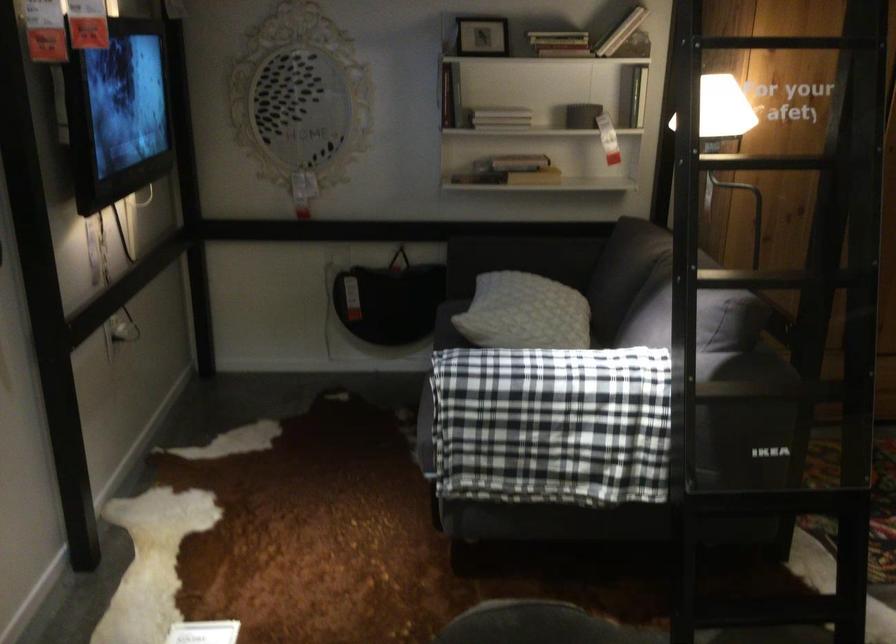
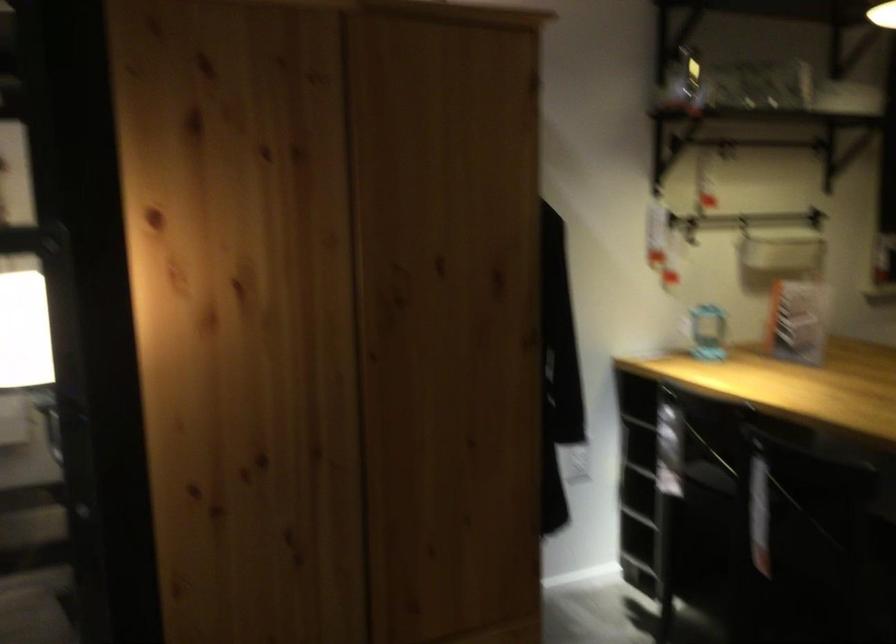
In a continuous first-person perspective shot, in which direction is the camera moving?

The cameraman moved toward right, forward.